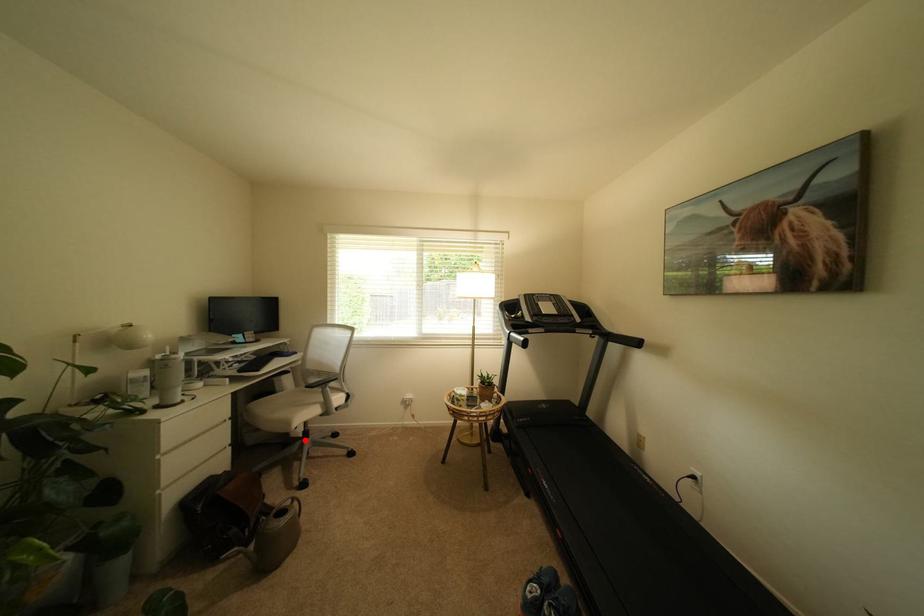
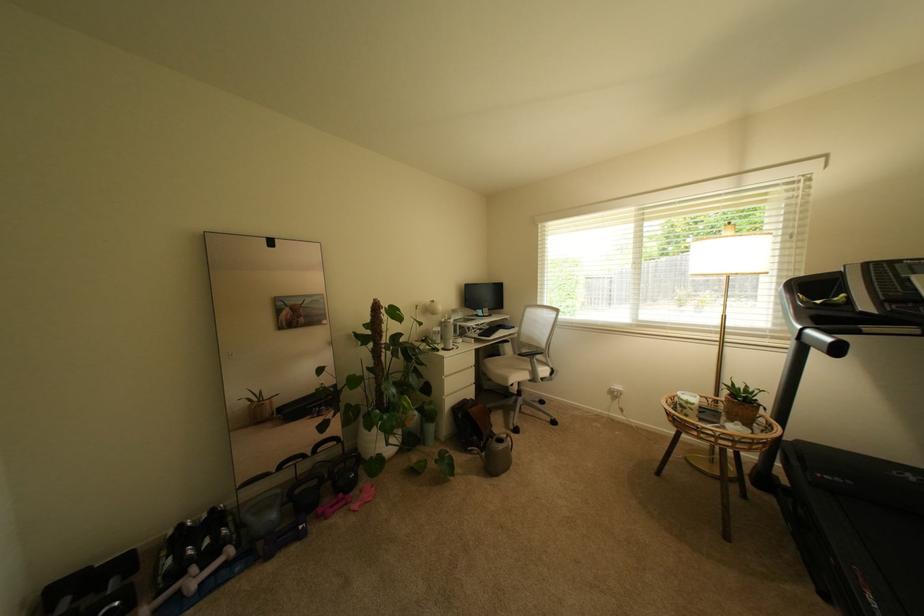
The point at the highlighted location is marked in the first image. Where is the corresponding point in the second image?

(521, 395)